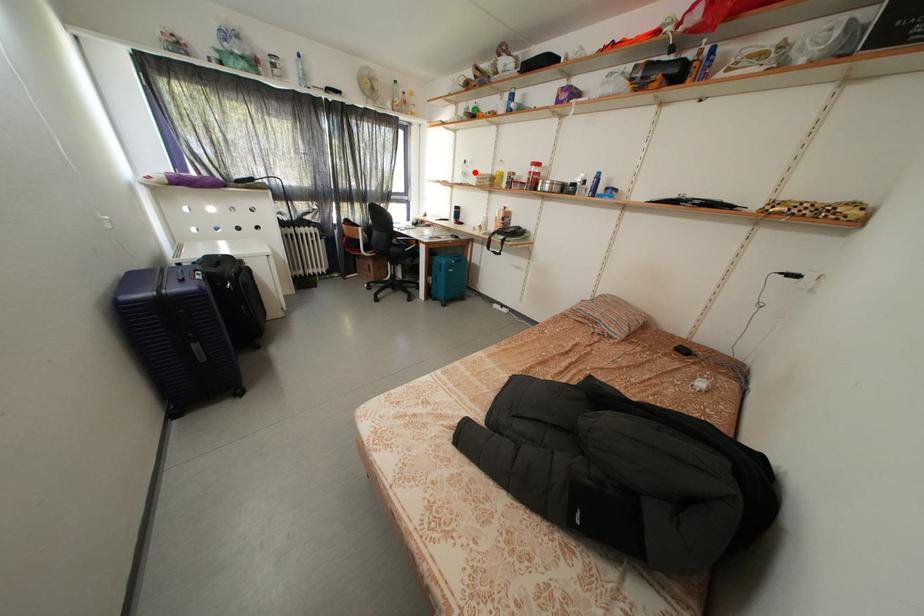
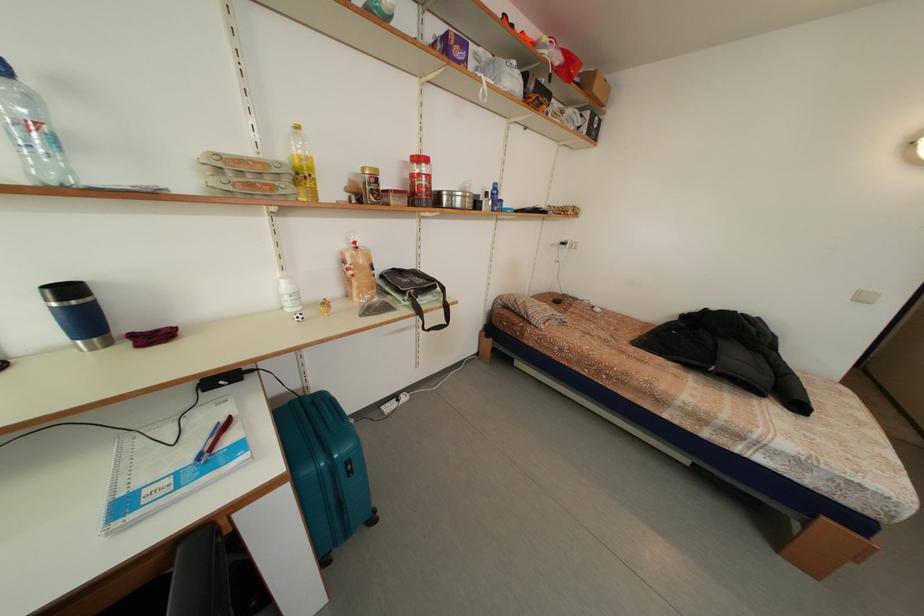
Where in the second image is the point corresponding to the highlighted location from the first image?

(40, 106)